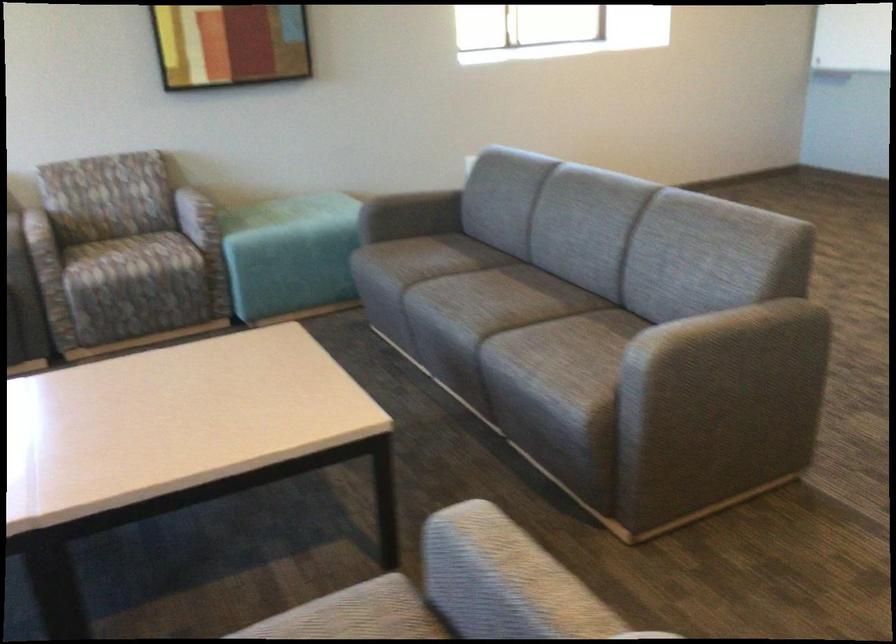
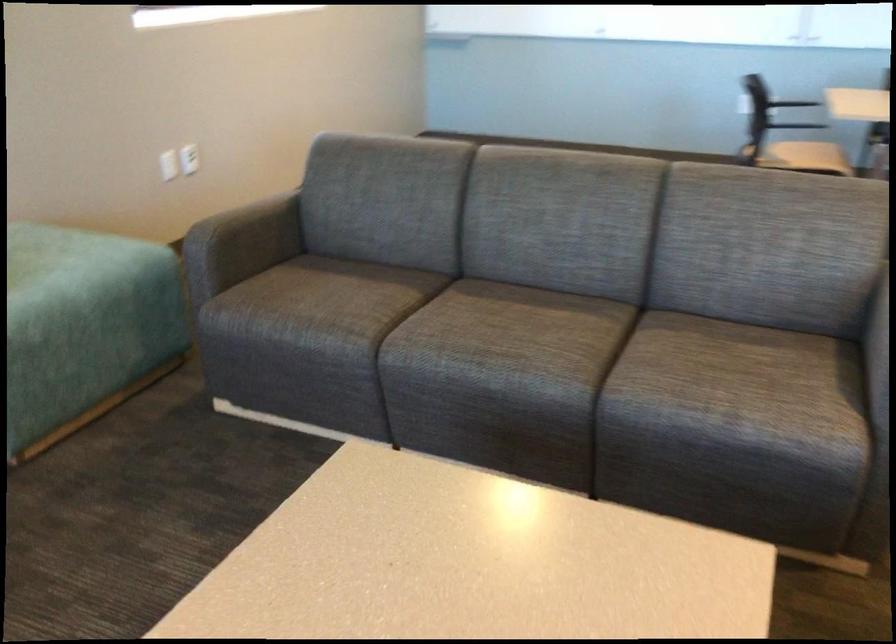
Find the pixel in the second image that matches point (338, 205) in the first image.

(56, 251)